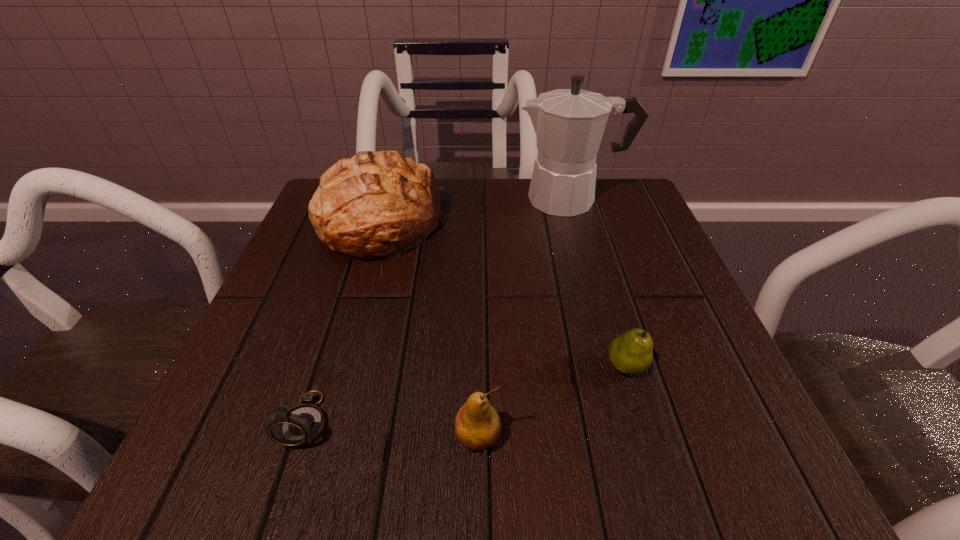
Where is `free spot between the bread and the compass`? Image resolution: width=960 pixels, height=540 pixels. free spot between the bread and the compass is located at coordinates (343, 322).

Image resolution: width=960 pixels, height=540 pixels. Identify the location of unoccupied position between the shorter pear and the second tallest object. (503, 295).

You are a GUI agent. You are given a task and a screenshot of the screen. Output one action in this format:
    pyautogui.click(x=<x>, y=<y>)
    Task: Click on the unoccupied position between the coffeepot and the left pear
    This screenshot has width=960, height=540.
    Given the screenshot: What is the action you would take?
    pyautogui.click(x=524, y=318)

You are a GUI agent. You are given a task and a screenshot of the screen. Output one action in this format:
    pyautogui.click(x=<x>, y=<y>)
    Task: Click on the free space between the third tallest object and the tallest object
    This screenshot has width=960, height=540.
    Given the screenshot: What is the action you would take?
    pyautogui.click(x=524, y=318)

Locate an element on the screen. The image size is (960, 540). free space between the compass and the farther pear is located at coordinates (466, 393).

Image resolution: width=960 pixels, height=540 pixels. Find the location of `free space between the fourth shortest object and the tallest object`. free space between the fourth shortest object and the tallest object is located at coordinates (475, 212).

This screenshot has height=540, width=960. I want to click on free space between the right pear and the left pear, so click(552, 402).

At what (x,y) coordinates should I click in order to perform the action: click on vacant area that lies between the compass and the shorter pear. Please return your answer as a coordinate pair (x, y). Looking at the image, I should click on (466, 393).

You are a GUI agent. You are given a task and a screenshot of the screen. Output one action in this format:
    pyautogui.click(x=<x>, y=<y>)
    Task: Click on the free space between the fourth shortest object and the compass
    
    Given the screenshot: What is the action you would take?
    pyautogui.click(x=343, y=322)

Locate an element on the screen. The image size is (960, 540). vacant space in between the left pear and the coffeepot is located at coordinates (524, 318).